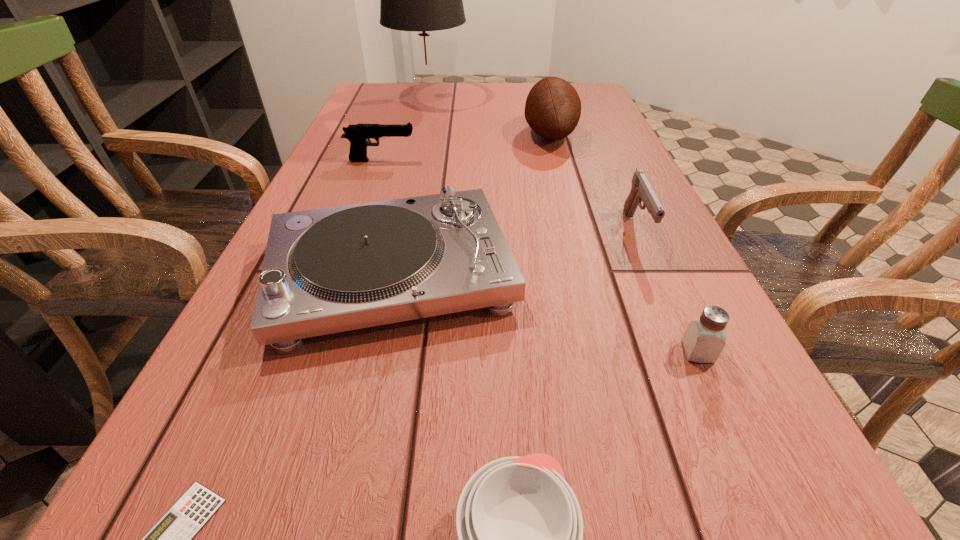
Identify the location of lampshade. (419, 0).

The height and width of the screenshot is (540, 960). In order to click on the farthest object in this screenshot , I will do pos(419,0).

I want to click on the seventh nearest object, so click(553, 107).

Locate an element on the screen. Image resolution: width=960 pixels, height=540 pixels. the sixth object from left to right is located at coordinates click(x=553, y=107).

Find the location of `the nearer pistol`. the nearer pistol is located at coordinates (641, 190).

Locate an element on the screen. The width and height of the screenshot is (960, 540). the sixth nearest object is located at coordinates (358, 134).

The width and height of the screenshot is (960, 540). What are the coordinates of `the farther pistol` in the screenshot? It's located at (358, 134).

You are a GUI agent. You are given a task and a screenshot of the screen. Output one action in this format:
    pyautogui.click(x=<x>, y=<y>)
    Task: Click on the record player
    
    Given the screenshot: What is the action you would take?
    pyautogui.click(x=328, y=270)

Find the location of a particular element. The width and height of the screenshot is (960, 540). the sixth tallest object is located at coordinates (704, 339).

Image resolution: width=960 pixels, height=540 pixels. I want to click on vacant region located 0.230m on the front of the lampshade, so click(417, 147).